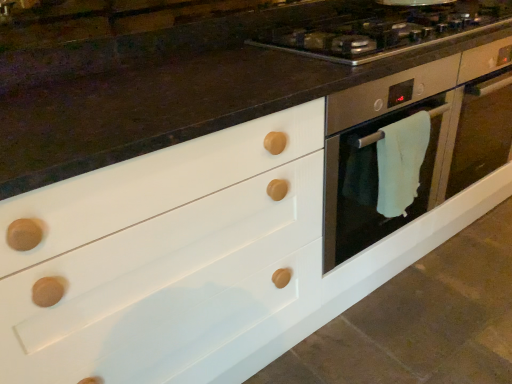
Describe the element at coordinates (401, 163) in the screenshot. This screenshot has width=512, height=384. I see `white towel at right` at that location.

The width and height of the screenshot is (512, 384). I want to click on satin silver gas stove at upper center, so click(x=384, y=29).

The width and height of the screenshot is (512, 384). What do you see at coordinates (425, 155) in the screenshot?
I see `satin silver oven at center right` at bounding box center [425, 155].

The width and height of the screenshot is (512, 384). What are the coordinates of `white towel at right` in the screenshot? It's located at (401, 163).

From a real-world perspective, is satin silver oven at center right physically located above or below satin silver gas stove at upper center?

Clearly, from a real-world perspective, satin silver oven at center right is below satin silver gas stove at upper center.

How many degrees apart are the facing directions of satin silver oven at center right and satin silver gas stove at upper center?

The angular difference between satin silver oven at center right and satin silver gas stove at upper center is 0.555 degrees.

Is satin silver oven at center right placed right next to satin silver gas stove at upper center?

satin silver oven at center right and satin silver gas stove at upper center are not in contact.

Between point (362, 201) and point (469, 31), which one is positioned in front?

The point (362, 201) is more forward.

Is white towel at right next to satin silver gas stove at upper center?

No, white towel at right is not next to satin silver gas stove at upper center.

Consider the image. Is white towel at right positioned with its back to satin silver gas stove at upper center?

No, white towel at right is not facing away from satin silver gas stove at upper center.

Considering the sizes of white towel at right and satin silver gas stove at upper center in the image, is white towel at right taller or shorter than satin silver gas stove at upper center?

Clearly, white towel at right is taller compared to satin silver gas stove at upper center.

From a real-world perspective, is white towel at right positioned above or below satin silver gas stove at upper center?

From a real-world perspective, white towel at right is physically below satin silver gas stove at upper center.

Based on the photo, who is bigger, satin silver oven at center right or white towel at right?

satin silver oven at center right.

Is satin silver oven at center right further to camera compared to white towel at right?

Yes, it is behind white towel at right.

From the image's perspective, which is above, satin silver oven at center right or white towel at right?

satin silver oven at center right appears higher in the image.

From the image's perspective, which one is positioned lower, satin silver gas stove at upper center or white towel at right?

white towel at right is shown below in the image.

Is satin silver gas stove at upper center further to the viewer compared to white towel at right?

No, it is in front of white towel at right.

Are satin silver gas stove at upper center and white towel at right making contact?

No, satin silver gas stove at upper center is not touching white towel at right.

Looking at the image, does satin silver gas stove at upper center seem bigger or smaller compared to white towel at right?

In the image, satin silver gas stove at upper center appears to be larger than white towel at right.

From their relative heights in the image, would you say white towel at right is taller or shorter than satin silver oven at center right?

In the image, white towel at right appears to be shorter than satin silver oven at center right.

Looking at the image, does white towel at right seem bigger or smaller compared to satin silver oven at center right?

white towel at right is smaller than satin silver oven at center right.

Between white towel at right and satin silver oven at center right, which one has smaller width?

Thinner between the two is white towel at right.

Which object is further away from the camera taking this photo, satin silver gas stove at upper center or satin silver oven at center right?

satin silver oven at center right is behind.

From the image's perspective, which one is positioned lower, satin silver gas stove at upper center or satin silver oven at center right?

satin silver oven at center right, from the image's perspective.

Does satin silver gas stove at upper center have a smaller size compared to satin silver oven at center right?

Indeed, satin silver gas stove at upper center has a smaller size compared to satin silver oven at center right.

Is satin silver oven at center right at the back of satin silver gas stove at upper center?

No, satin silver oven at center right is not at the back of satin silver gas stove at upper center.

Find the location of a particular element. oven located underneath the satin silver gas stove at upper center (from a real-world perspective) is located at coordinates (425, 155).

What are the coordinates of `gas stove on the right of white towel at right` in the screenshot? It's located at (384, 29).

Looking at the image, which one is located further to satin silver gas stove at upper center, white towel at right or satin silver oven at center right?

The object further to satin silver gas stove at upper center is white towel at right.

Based on their spatial positions, is satin silver gas stove at upper center or white towel at right closer to satin silver oven at center right?

The object closer to satin silver oven at center right is white towel at right.

Based on their spatial positions, is satin silver oven at center right or white towel at right further from satin silver gas stove at upper center?

Based on the image, white towel at right appears to be further to satin silver gas stove at upper center.

Considering their positions, is white towel at right positioned closer to satin silver oven at center right than satin silver gas stove at upper center?

Among the two, white towel at right is located nearer to satin silver oven at center right.

Based on their spatial positions, is satin silver gas stove at upper center or satin silver oven at center right closer to white towel at right?

satin silver oven at center right is positioned closer to the anchor white towel at right.

Which object lies nearer to the anchor point white towel at right, satin silver oven at center right or satin silver gas stove at upper center?

The object closer to white towel at right is satin silver oven at center right.

Locate an element on the screen. The width and height of the screenshot is (512, 384). oven that lies between satin silver gas stove at upper center and white towel at right from top to bottom is located at coordinates (425, 155).